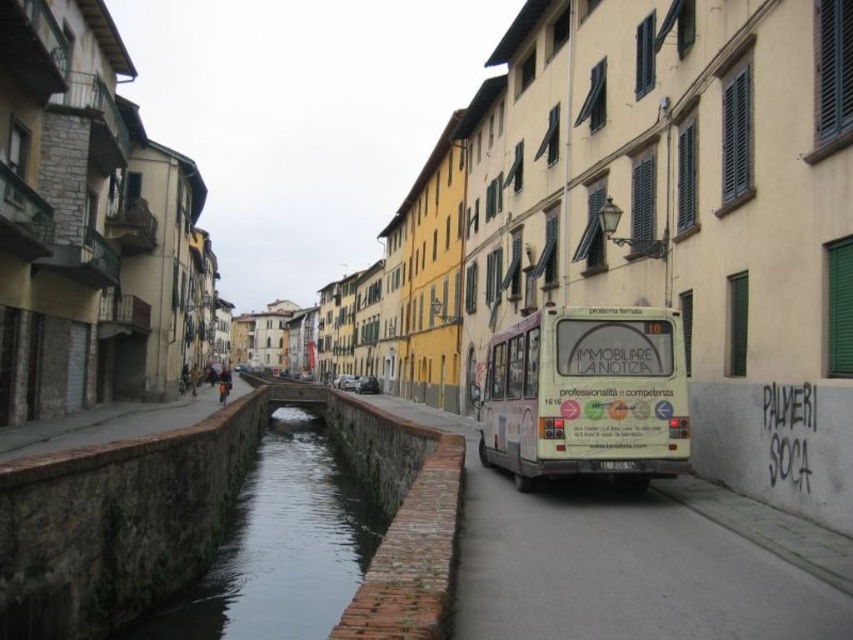
Can you confirm if dark gray concrete river at center is taller than brick at lower center?

In fact, dark gray concrete river at center may be shorter than brick at lower center.

In the scene shown: Does dark gray concrete river at center come behind brick at lower center?

Yes.

Is point (305, 506) positioned in front of point (453, 540)?

No, (305, 506) is further to viewer.

Identify the location of dark gray concrete river at center. This screenshot has height=640, width=853. (279, 547).

Between white matte bus at center and brick at lower center, which one is positioned lower?

Positioned lower is brick at lower center.

Is point (583, 326) positioned after point (363, 456)?

No, it is in front of (363, 456).

The width and height of the screenshot is (853, 640). In order to click on white matte bus at center in this screenshot , I will do `click(585, 394)`.

You are a GUI agent. You are given a task and a screenshot of the screen. Output one action in this format:
    pyautogui.click(x=<x>, y=<y>)
    Task: Click on the white matte bus at center
    Image resolution: width=853 pixels, height=640 pixels.
    Given the screenshot: What is the action you would take?
    pyautogui.click(x=585, y=394)

Does white matte bus at center have a lesser height compared to dark gray concrete river at center?

In fact, white matte bus at center may be taller than dark gray concrete river at center.

Locate an element on the screen. white matte bus at center is located at coordinates tap(585, 394).

Is point (581, 397) positioned before point (316, 561)?

Yes.

Image resolution: width=853 pixels, height=640 pixels. In order to click on white matte bus at center in this screenshot , I will do `click(585, 394)`.